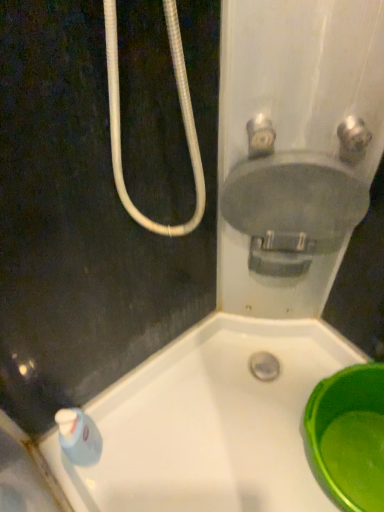
Question: Is matte gray sink at upper right shorter than satin nickel faucet at upper right, which is the second plumbing fixture in left-to-right order?

Choices:
 (A) yes
 (B) no

Answer: (B)

Question: Considering the relative sizes of matte gray sink at upper right and satin nickel faucet at upper right, which is the second plumbing fixture in left-to-right order, in the image provided, is matte gray sink at upper right taller than satin nickel faucet at upper right, which is the second plumbing fixture in left-to-right order,?

Choices:
 (A) no
 (B) yes

Answer: (B)

Question: Considering the relative sizes of matte gray sink at upper right and satin nickel faucet at upper right, the first plumbing fixture in the right-to-left sequence, in the image provided, is matte gray sink at upper right smaller than satin nickel faucet at upper right, the first plumbing fixture in the right-to-left sequence,?

Choices:
 (A) no
 (B) yes

Answer: (A)

Question: Is matte gray sink at upper right not inside satin nickel faucet at upper right, which is the second plumbing fixture in left-to-right order?

Choices:
 (A) yes
 (B) no

Answer: (A)

Question: Is matte gray sink at upper right behind satin nickel faucet at upper right, which is the second plumbing fixture in left-to-right order?

Choices:
 (A) no
 (B) yes

Answer: (B)

Question: From the image's perspective, does matte gray sink at upper right appear higher than satin nickel faucet at upper right, which is the second plumbing fixture in left-to-right order?

Choices:
 (A) yes
 (B) no

Answer: (B)

Question: Is matte gray valve at upper right, which ranks as the 1th plumbing fixture in left-to-right order, further to the viewer compared to matte gray sink at upper right?

Choices:
 (A) yes
 (B) no

Answer: (B)

Question: From a real-world perspective, does matte gray valve at upper right, acting as the second plumbing fixture starting from the right, sit lower than matte gray sink at upper right?

Choices:
 (A) no
 (B) yes

Answer: (A)

Question: Does matte gray valve at upper right, which ranks as the 1th plumbing fixture in left-to-right order, have a lesser width compared to matte gray sink at upper right?

Choices:
 (A) yes
 (B) no

Answer: (A)

Question: From a real-world perspective, is matte gray valve at upper right, acting as the second plumbing fixture starting from the right, positioned over matte gray sink at upper right based on gravity?

Choices:
 (A) no
 (B) yes

Answer: (B)

Question: Can you confirm if matte gray valve at upper right, which ranks as the 1th plumbing fixture in left-to-right order, is taller than matte gray sink at upper right?

Choices:
 (A) yes
 (B) no

Answer: (B)

Question: Could you tell me if matte gray valve at upper right, acting as the second plumbing fixture starting from the right, is turned towards matte gray sink at upper right?

Choices:
 (A) yes
 (B) no

Answer: (B)

Question: Can matte gray valve at upper right, acting as the second plumbing fixture starting from the right, be found inside green plastic basin at lower right?

Choices:
 (A) yes
 (B) no

Answer: (B)